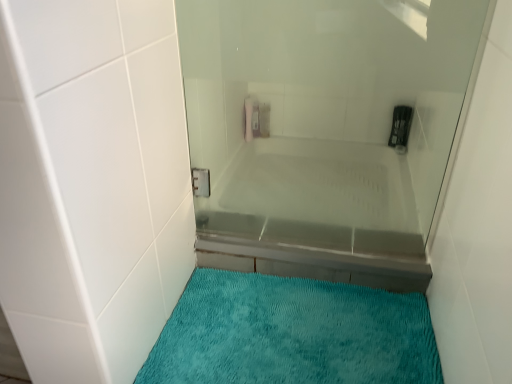
In order to click on transparent glass shower door at center in this screenshot , I will do `click(326, 131)`.

Identify the location of teal plush bath mat at lower center. The height and width of the screenshot is (384, 512). (292, 334).

Which of these two, clear glass bathtub at center or teal plush bath mat at lower center, is wider?

teal plush bath mat at lower center.

In terms of size, does clear glass bathtub at center appear bigger or smaller than teal plush bath mat at lower center?

Considering their sizes, clear glass bathtub at center takes up more space than teal plush bath mat at lower center.

Is clear glass bathtub at center positioned with its back to teal plush bath mat at lower center?

clear glass bathtub at center is not turned away from teal plush bath mat at lower center.

Is clear glass bathtub at center at the left side of teal plush bath mat at lower center?

In fact, clear glass bathtub at center is to the right of teal plush bath mat at lower center.

Is point (180, 12) less distant than point (202, 361)?

Yes.

Can you confirm if transparent glass shower door at center is bigger than teal plush bath mat at lower center?

Correct, transparent glass shower door at center is larger in size than teal plush bath mat at lower center.

From the image's perspective, which object appears higher, transparent glass shower door at center or teal plush bath mat at lower center?

transparent glass shower door at center, from the image's perspective.

What's the angular difference between transparent glass shower door at center and teal plush bath mat at lower center's facing directions?

transparent glass shower door at center and teal plush bath mat at lower center are facing 0.695 degrees away from each other.

In the scene shown: Is clear glass bathtub at center taller or shorter than transparent glass shower door at center?

clear glass bathtub at center is shorter than transparent glass shower door at center.

How different are the orientations of clear glass bathtub at center and transparent glass shower door at center in degrees?

clear glass bathtub at center and transparent glass shower door at center are facing 0.695 degrees away from each other.

Do you think clear glass bathtub at center is within transparent glass shower door at center, or outside of it?

clear glass bathtub at center is spatially situated outside transparent glass shower door at center.

Does clear glass bathtub at center come behind transparent glass shower door at center?

Yes, clear glass bathtub at center is further from the viewer.

Which of these two, teal plush bath mat at lower center or transparent glass shower door at center, is wider?

teal plush bath mat at lower center.

Based on the photo, is teal plush bath mat at lower center positioned far away from transparent glass shower door at center?

No, teal plush bath mat at lower center is not far from transparent glass shower door at center.

Is teal plush bath mat at lower center oriented away from transparent glass shower door at center?

No, teal plush bath mat at lower center's orientation is not away from transparent glass shower door at center.

How many degrees apart are the facing directions of transparent glass shower door at center and clear glass bathtub at center?

There is a 0.695-degree angle between the facing directions of transparent glass shower door at center and clear glass bathtub at center.

Between transparent glass shower door at center and clear glass bathtub at center, which one appears on the left side from the viewer's perspective?

transparent glass shower door at center.

How much distance is there between transparent glass shower door at center and clear glass bathtub at center?

transparent glass shower door at center and clear glass bathtub at center are 5.83 centimeters apart.

Who is taller, transparent glass shower door at center or clear glass bathtub at center?

Standing taller between the two is transparent glass shower door at center.

Which object is further away from the camera taking this photo, teal plush bath mat at lower center or clear glass bathtub at center?

clear glass bathtub at center is further away from the camera.

Is teal plush bath mat at lower center oriented towards clear glass bathtub at center?

No, teal plush bath mat at lower center is not aimed at clear glass bathtub at center.

Would you say teal plush bath mat at lower center contains clear glass bathtub at center?

That's incorrect, clear glass bathtub at center is not inside teal plush bath mat at lower center.

Where is `bath mat below the clear glass bathtub at center (from the image's perspective)`? This screenshot has height=384, width=512. bath mat below the clear glass bathtub at center (from the image's perspective) is located at coordinates (292, 334).

The height and width of the screenshot is (384, 512). In order to click on shower door on the right of teal plush bath mat at lower center in this screenshot , I will do `click(326, 131)`.

Looking at the image, which one is located further to clear glass bathtub at center, teal plush bath mat at lower center or transparent glass shower door at center?

teal plush bath mat at lower center lies further to clear glass bathtub at center than the other object.

Looking at the image, which one is located closer to transparent glass shower door at center, teal plush bath mat at lower center or clear glass bathtub at center?

clear glass bathtub at center lies closer to transparent glass shower door at center than the other object.

Considering their positions, is clear glass bathtub at center positioned closer to teal plush bath mat at lower center than transparent glass shower door at center?

Based on the image, clear glass bathtub at center appears to be nearer to teal plush bath mat at lower center.

Which object lies nearer to the anchor point teal plush bath mat at lower center, transparent glass shower door at center or clear glass bathtub at center?

Based on the image, clear glass bathtub at center appears to be nearer to teal plush bath mat at lower center.

Considering their positions, is clear glass bathtub at center positioned further to transparent glass shower door at center than teal plush bath mat at lower center?

Based on the image, teal plush bath mat at lower center appears to be further to transparent glass shower door at center.

Based on their spatial positions, is transparent glass shower door at center or teal plush bath mat at lower center closer to clear glass bathtub at center?

The object closer to clear glass bathtub at center is transparent glass shower door at center.

The width and height of the screenshot is (512, 384). I want to click on bathtub between transparent glass shower door at center and teal plush bath mat at lower center in the vertical direction, so click(319, 212).